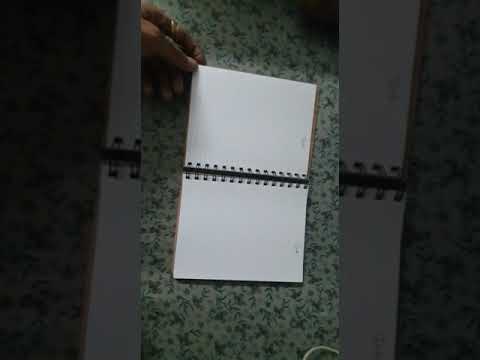
This screenshot has height=360, width=480. In order to click on blank right side of notebook in this screenshot , I will do pos(223,230).